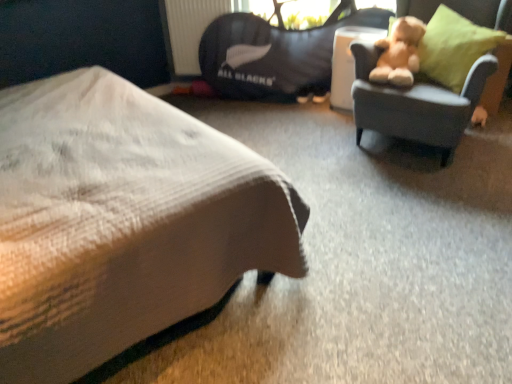
Question: Can you confirm if green fabric pillow at right is thinner than white textured bed at lower left?

Choices:
 (A) yes
 (B) no

Answer: (A)

Question: Is green fabric pillow at right taller than white textured bed at lower left?

Choices:
 (A) no
 (B) yes

Answer: (A)

Question: Is green fabric pillow at right not near white textured bed at lower left?

Choices:
 (A) no
 (B) yes

Answer: (B)

Question: Is green fabric pillow at right wider than white textured bed at lower left?

Choices:
 (A) no
 (B) yes

Answer: (A)

Question: Is green fabric pillow at right oriented towards white textured bed at lower left?

Choices:
 (A) no
 (B) yes

Answer: (B)

Question: From a real-world perspective, is soft gray fabric chair at upper right physically located above or below fluffy beige teddy bear at upper right?

Choices:
 (A) above
 (B) below

Answer: (B)

Question: Does point (386, 107) appear closer or farther from the camera than point (389, 44)?

Choices:
 (A) closer
 (B) farther

Answer: (A)

Question: Based on their sizes in the image, would you say soft gray fabric chair at upper right is bigger or smaller than fluffy beige teddy bear at upper right?

Choices:
 (A) big
 (B) small

Answer: (A)

Question: Is soft gray fabric chair at upper right taller or shorter than fluffy beige teddy bear at upper right?

Choices:
 (A) tall
 (B) short

Answer: (A)

Question: In terms of size, does white textured bed at lower left appear bigger or smaller than black fabric bean bag at upper center?

Choices:
 (A) small
 (B) big

Answer: (B)

Question: Considering the positions of white textured bed at lower left and black fabric bean bag at upper center in the image, is white textured bed at lower left wider or thinner than black fabric bean bag at upper center?

Choices:
 (A) wide
 (B) thin

Answer: (A)

Question: From a real-world perspective, is white textured bed at lower left above or below black fabric bean bag at upper center?

Choices:
 (A) above
 (B) below

Answer: (A)

Question: In terms of height, does white textured bed at lower left look taller or shorter compared to black fabric bean bag at upper center?

Choices:
 (A) short
 (B) tall

Answer: (B)

Question: Is soft gray fabric chair at upper right bigger or smaller than black fabric bean bag at upper center?

Choices:
 (A) small
 (B) big

Answer: (B)

Question: Visually, is soft gray fabric chair at upper right positioned to the left or to the right of black fabric bean bag at upper center?

Choices:
 (A) right
 (B) left

Answer: (A)